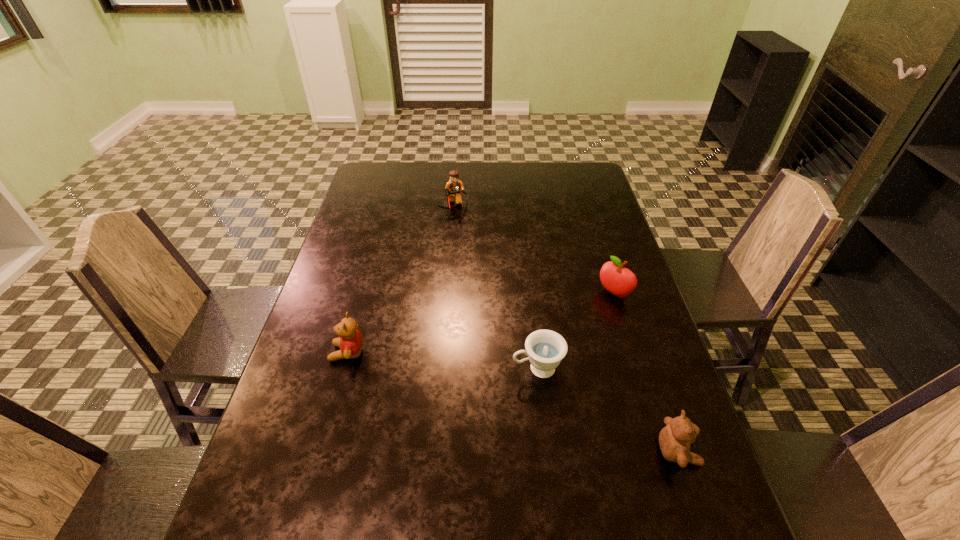
You are a GUI agent. You are given a task and a screenshot of the screen. Output one action in this format:
    pyautogui.click(x=<x>, y=<y>)
    Task: Click on the blank space located 0.310m on the front-facing side of the second farthest object
    
    Given the screenshot: What is the action you would take?
    pyautogui.click(x=530, y=364)

This screenshot has width=960, height=540. Identify the location of vacant space located on the front-facing side of the second farthest object. (554, 344).

Find the location of a particular element. vacant space located on the side of the third object from right to left with the handle is located at coordinates (471, 380).

The height and width of the screenshot is (540, 960). I want to click on free location located 0.220m on the side of the third object from right to left with the handle, so [420, 389].

Locate an element on the screen. vacant space located 0.270m on the side of the third object from right to left with the handle is located at coordinates (398, 393).

This screenshot has width=960, height=540. Identify the location of vacant space located 0.150m holding a crossbow in the hands of the farthest object. (462, 243).

Where is `free location located holding a crossbow in the hands of the farthest object`? free location located holding a crossbow in the hands of the farthest object is located at coordinates (470, 276).

Image resolution: width=960 pixels, height=540 pixels. In order to click on vacant space located 0.290m holding a crossbow in the hands of the farthest object in this screenshot , I will do `click(469, 272)`.

The width and height of the screenshot is (960, 540). What are the coordinates of `object that is at the near edge` in the screenshot? It's located at (674, 439).

This screenshot has width=960, height=540. What are the coordinates of `object that is at the left edge` in the screenshot? It's located at (351, 342).